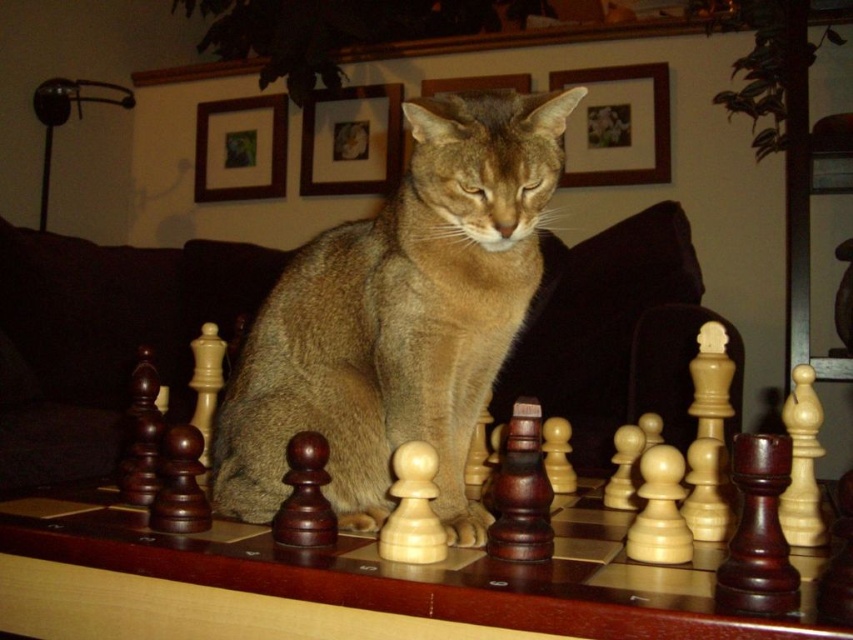
Is golden fur cat at center below wooden chess pieces at center?

Actually, golden fur cat at center is above wooden chess pieces at center.

Is point (407, 122) positioned after point (421, 614)?

That is True.

Find the location of a particular element. The height and width of the screenshot is (640, 853). golden fur cat at center is located at coordinates (399, 317).